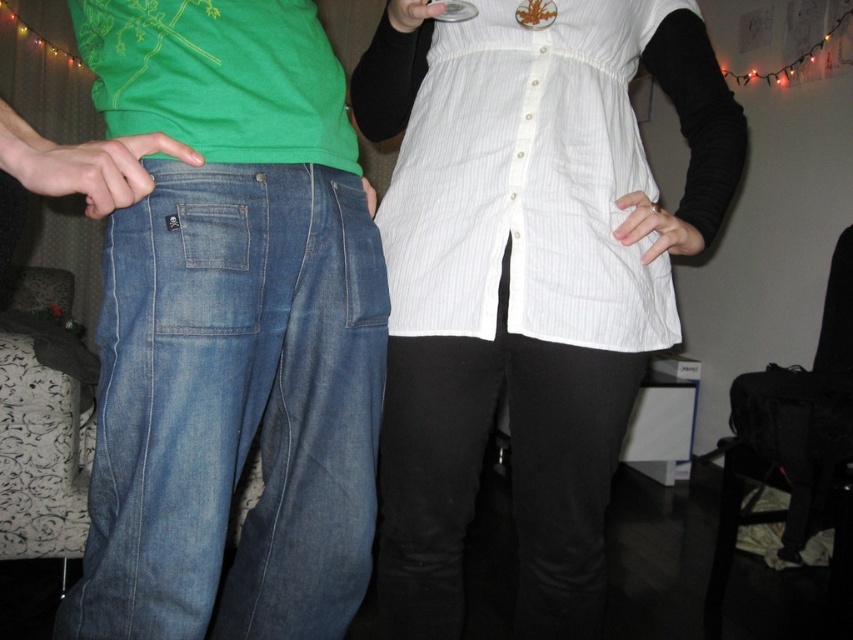
You are a delivery person who just arrived at the door. You need to place a package on the white striped apron at center. Can you reach it from your current position?

The white striped apron at center is 36.29 inches away from the viewer, so yes, you can reach it from your current position as it is within a typical reaching distance.

You are a delivery person who just entered a house and see the white striped apron at center. Where should you place the apron to return it to its original position?

You should place the white striped apron at center back at point (x=527, y=180).